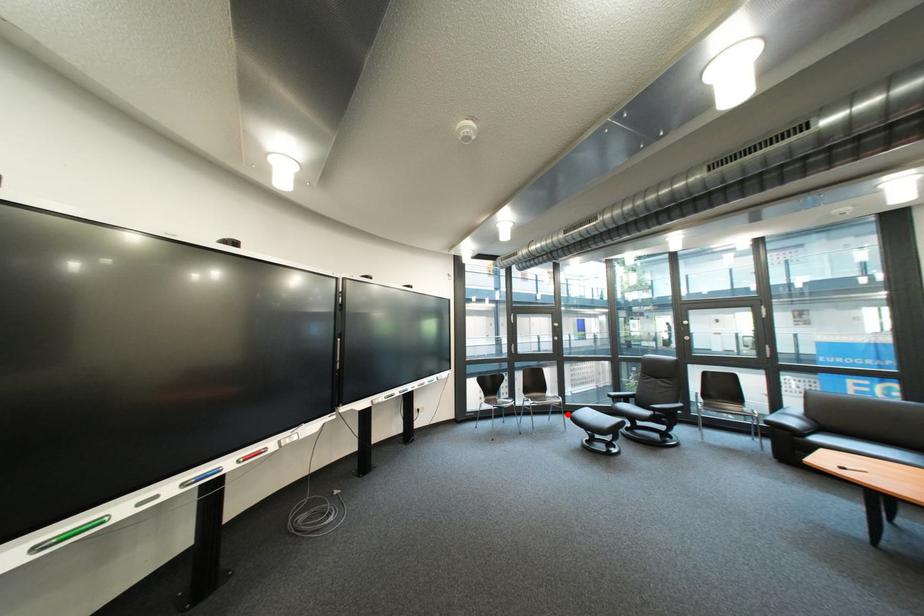
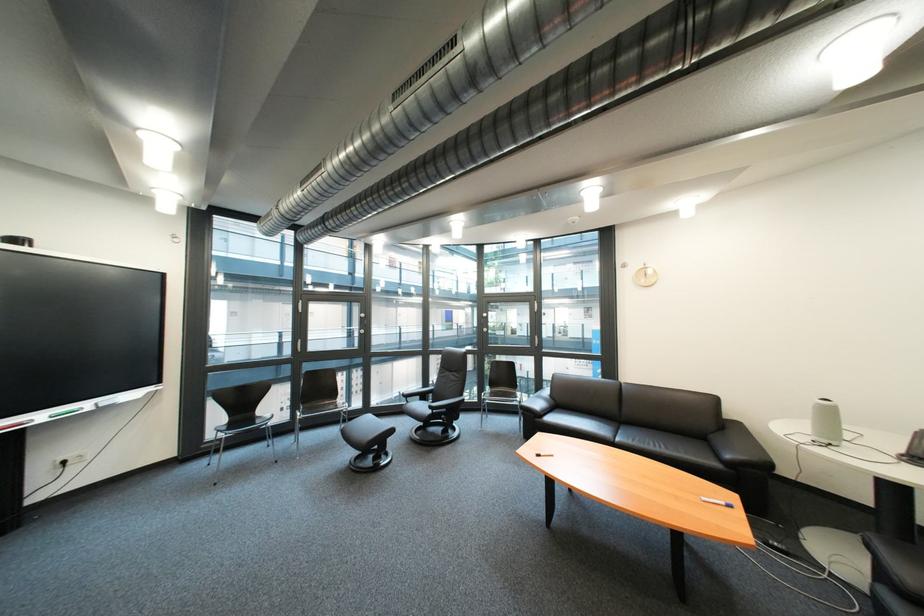
Where in the second image is the point corresponding to the highlighted location from the first image?

(359, 424)